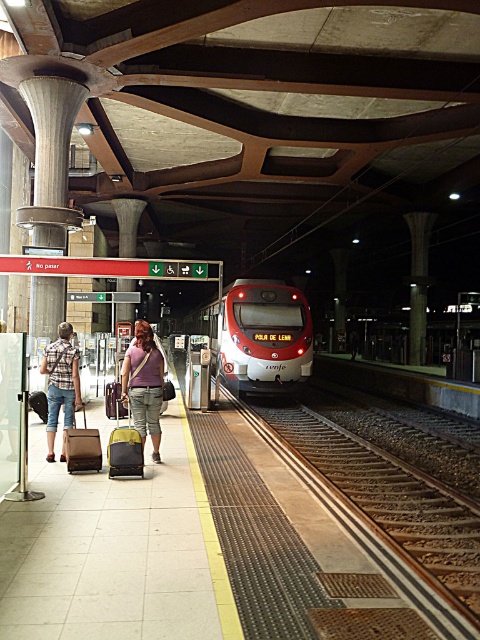
Is smooth concrete platform at lower left behind smooth metal train track at center?

Yes, smooth concrete platform at lower left is further from the viewer.

Can you confirm if smooth concrete platform at lower left is positioned to the left of smooth metal train track at center?

Yes, smooth concrete platform at lower left is to the left of smooth metal train track at center.

Is point (52, 612) closer to camera compared to point (288, 416)?

That is True.

Where is `smooth concrete platform at lower left`? The width and height of the screenshot is (480, 640). smooth concrete platform at lower left is located at coordinates (116, 548).

Can you confirm if smooth metal train track at center is positioned below yellow fabric suitcase at left?

Indeed, smooth metal train track at center is positioned under yellow fabric suitcase at left.

Which is above, smooth metal train track at center or yellow fabric suitcase at left?

yellow fabric suitcase at left is higher up.

I want to click on smooth metal train track at center, so pos(391,502).

Between point (259, 340) and point (129, 372), which one is positioned behind?

Positioned behind is point (259, 340).

Is the position of red glossy train at center more distant than that of matte purple shirt at center?

Yes, red glossy train at center is further from the viewer.

Does point (249, 349) lie behind point (142, 413)?

Yes, it is behind point (142, 413).

This screenshot has height=640, width=480. Find the location of `red glossy train at center`. red glossy train at center is located at coordinates (260, 337).